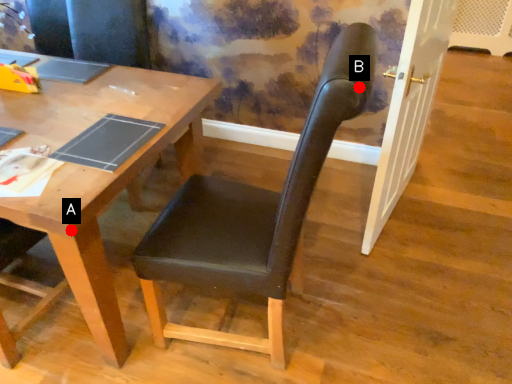
Question: Two points are circled on the image, labeled by A and B beside each circle. Among these points, which one is farthest from the camera?

Choices:
 (A) A is further
 (B) B is further

Answer: (A)